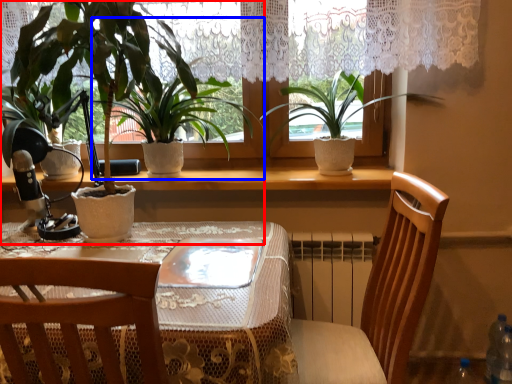
Question: Among these objects, which one is nearest to the camera, houseplant (highlighted by a red box) or houseplant (highlighted by a blue box)?

Choices:
 (A) houseplant
 (B) houseplant

Answer: (A)